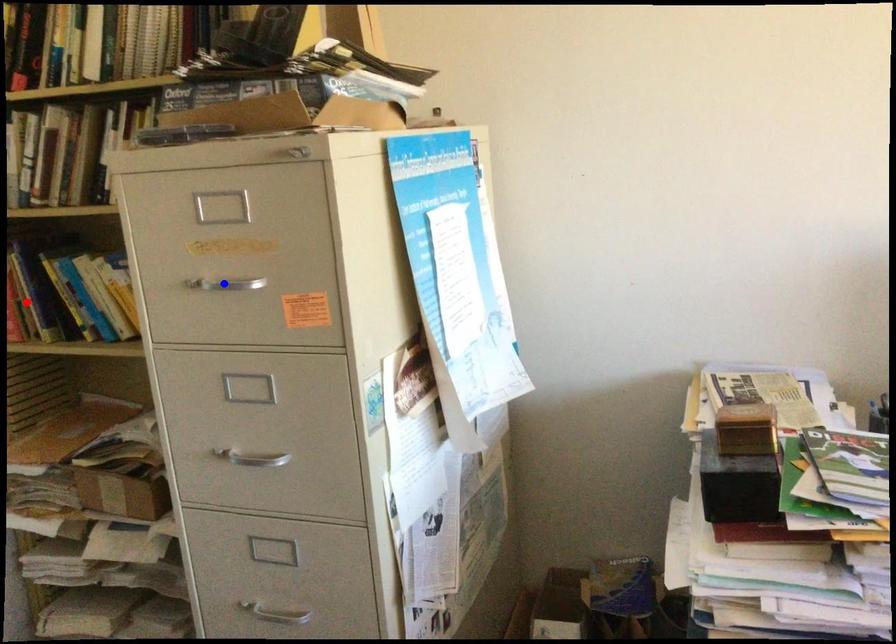
Question: Which of the two points in the image is closer to the camera?

Choices:
 (A) Blue point is closer.
 (B) Red point is closer.

Answer: (A)